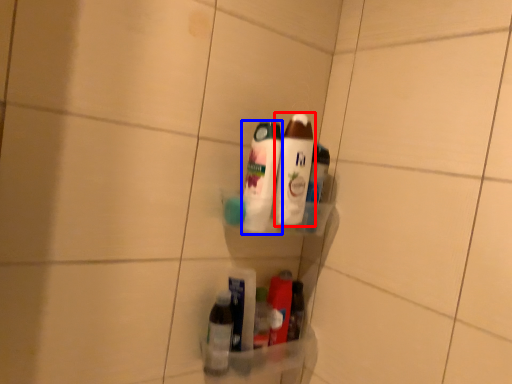
Question: Among these objects, which one is nearest to the camera, bottle (highlighted by a red box) or bottle (highlighted by a blue box)?

Choices:
 (A) bottle
 (B) bottle

Answer: (B)